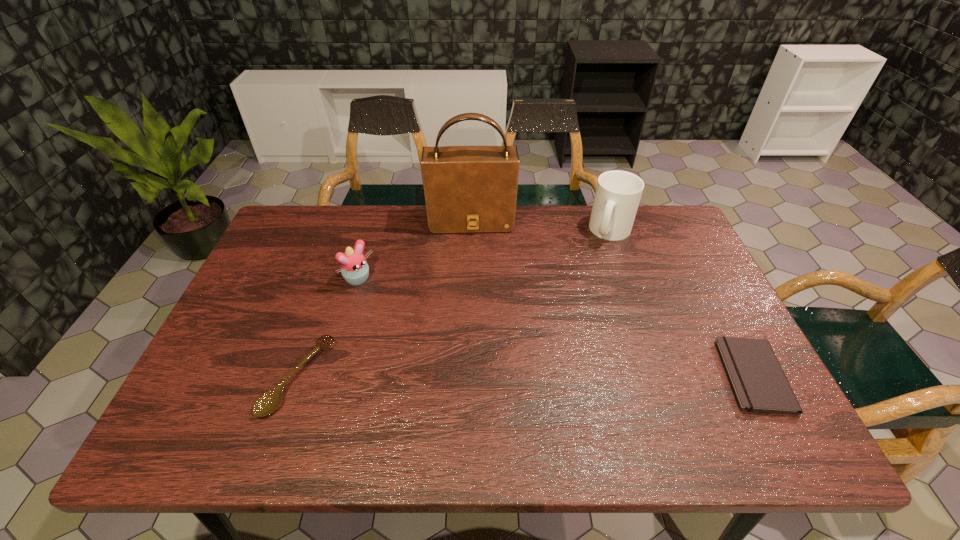
This screenshot has height=540, width=960. Find the location of `mug located at the far edge`. mug located at the far edge is located at coordinates 618,193.

At what (x,y) coordinates should I click in order to perform the action: click on shoulder bag present at the far edge. Please return your answer as a coordinate pair (x, y). The image size is (960, 540). Looking at the image, I should click on (468, 189).

What are the coordinates of `ladle that is positioned at the near edge` in the screenshot? It's located at (267, 403).

The height and width of the screenshot is (540, 960). Find the location of `checkbook at the near edge`. checkbook at the near edge is located at coordinates (759, 384).

You are a GUI agent. You are given a task and a screenshot of the screen. Output one action in this format:
    pyautogui.click(x=<x>, y=<y>)
    Task: Click on the object at the left edge
    This screenshot has width=960, height=540.
    Given the screenshot: What is the action you would take?
    pyautogui.click(x=267, y=403)

Where is `object that is at the right edge`? This screenshot has width=960, height=540. object that is at the right edge is located at coordinates (759, 384).

Find the location of a particular element. object that is at the near left corner is located at coordinates (267, 403).

Locate an element on the screen. This screenshot has height=540, width=960. object that is at the near right corner is located at coordinates (759, 384).

I want to click on vacant space at the far edge of the desktop, so [x=440, y=247].

I want to click on free spot at the near edge of the desktop, so tap(494, 393).